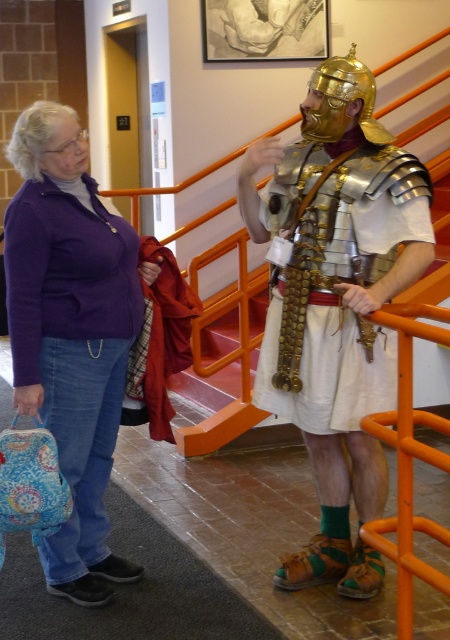
Between shiny gold armor at center and purple sweater at left, which one is positioned lower?

purple sweater at left is below.

Between point (301, 145) and point (102, 390), which one is positioned behind?

The point (301, 145) is more distant.

You are a GUI agent. You are given a task and a screenshot of the screen. Output one action in this format:
    pyautogui.click(x=<x>, y=<y>)
    Task: Click on the shiny gold armor at center
    The width and height of the screenshot is (450, 640).
    Given the screenshot: What is the action you would take?
    pyautogui.click(x=337, y=301)

Where is `shiny gold armor at center`? Image resolution: width=450 pixels, height=640 pixels. shiny gold armor at center is located at coordinates (337, 301).